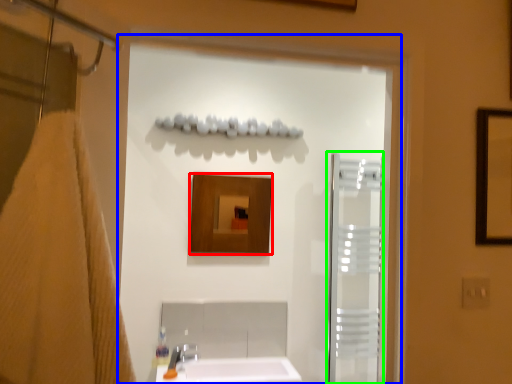
Question: Estimate the real-world distances between objects in this image. Which object is closer to mirror (highlighted by a red box), screen door (highlighted by a blue box) or screen door (highlighted by a green box)?

Choices:
 (A) screen door
 (B) screen door

Answer: (A)